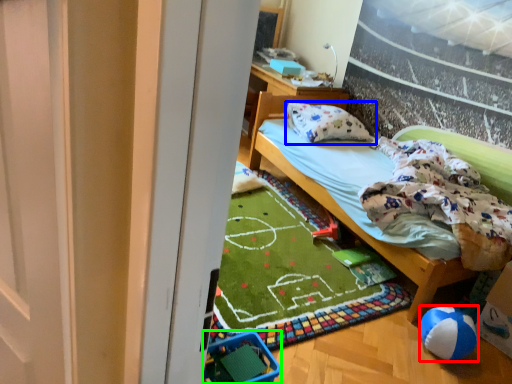
Question: Which object is the closest to the ball (highlighted by a red box)? Choose among these: pillow (highlighted by a blue box) or baby carriage (highlighted by a green box).

Choices:
 (A) pillow
 (B) baby carriage

Answer: (B)